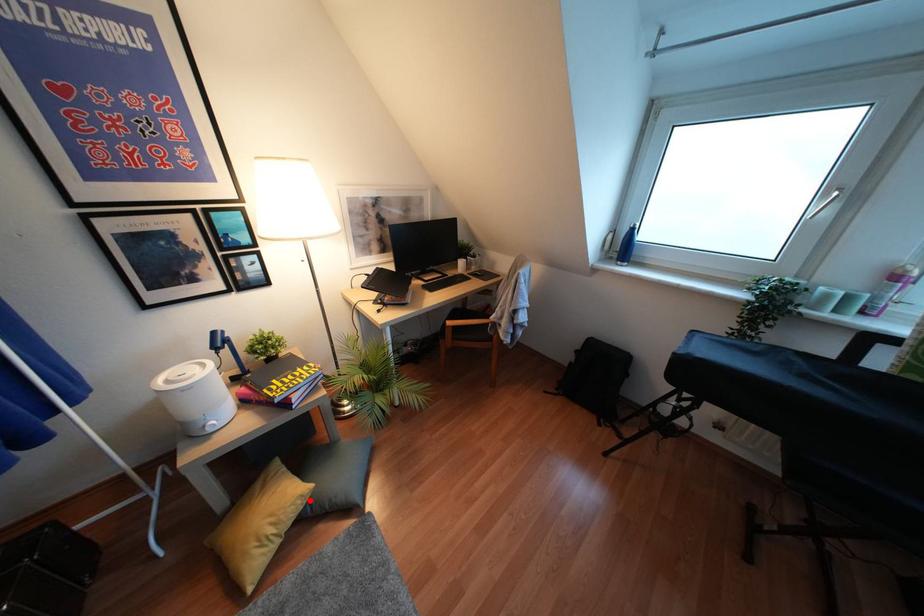
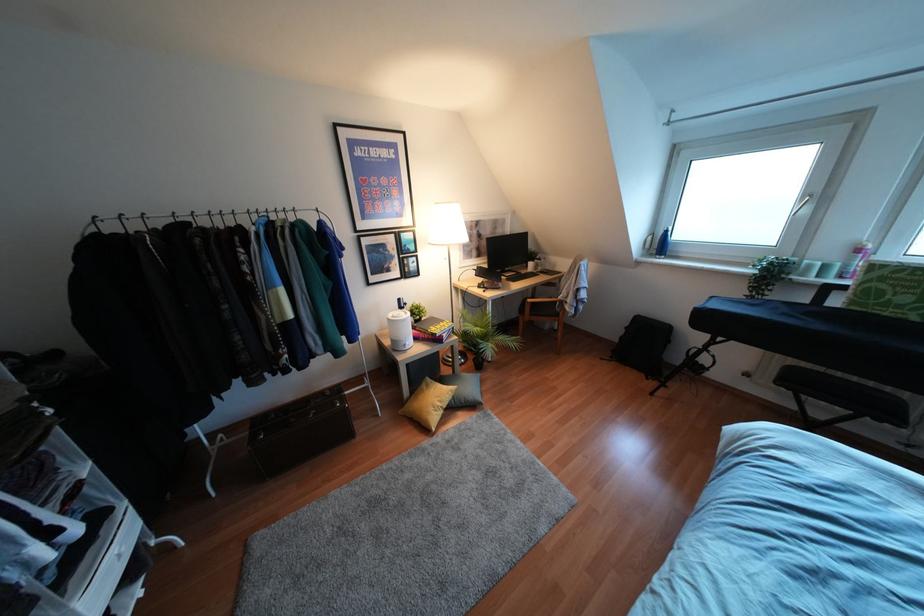
Question: I am providing you with two images of the same scene from different viewpoints. A red point is shown in image1. For the corresponding object point in image2, is it positioned nearer or farther from the camera?

Choices:
 (A) Nearer
 (B) Farther

Answer: (A)